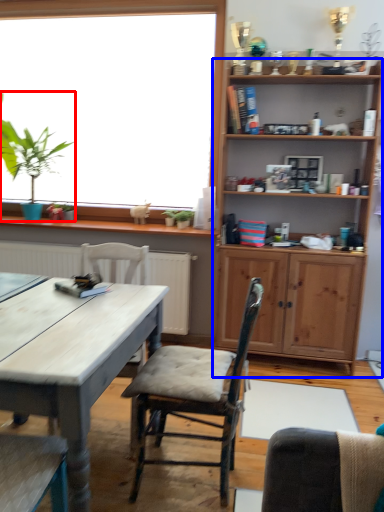
Question: Which of the following is the closest to the observer, houseplant (highlighted by a red box) or shelf (highlighted by a blue box)?

Choices:
 (A) houseplant
 (B) shelf

Answer: (B)